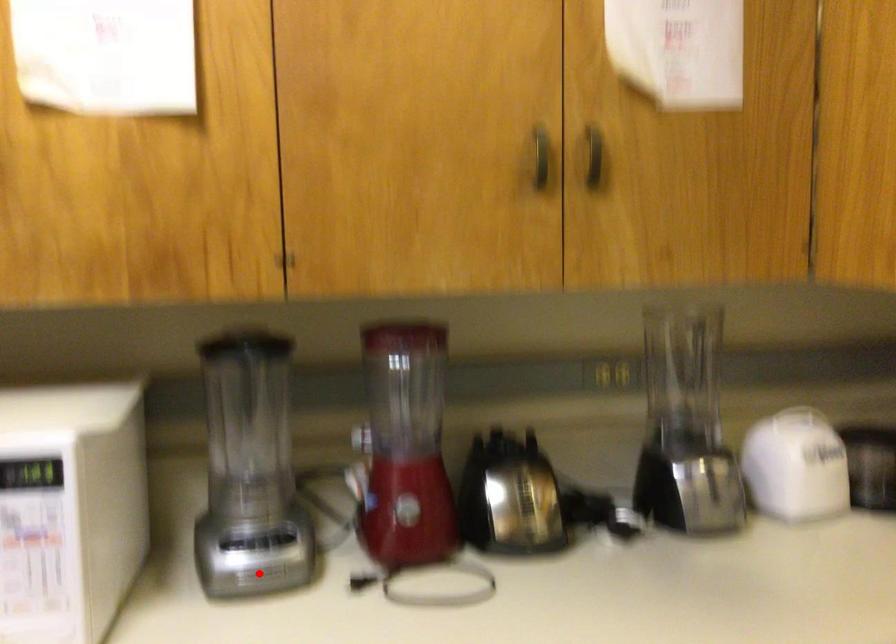
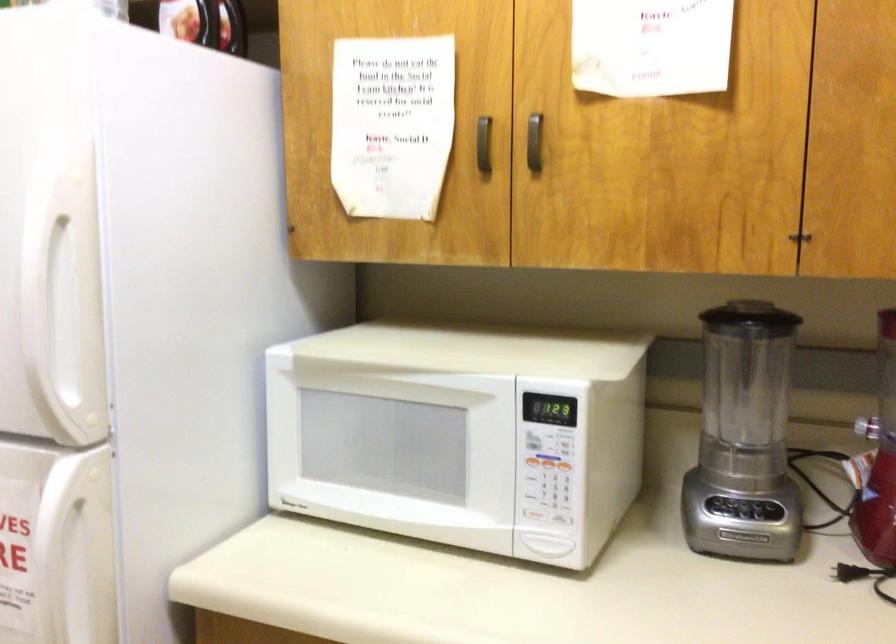
Locate, in the second image, the point that corresponds to the highlighted location in the first image.

(743, 536)